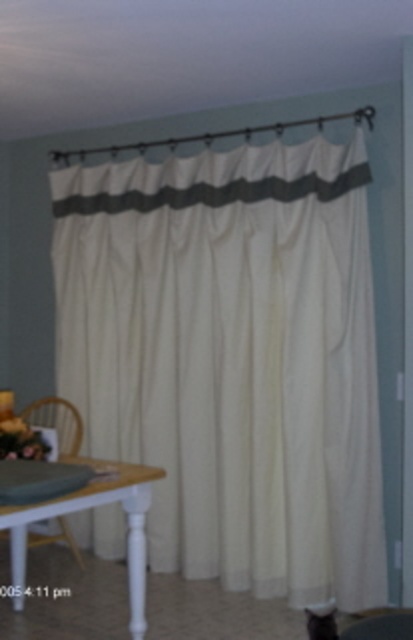
Locate an element on the screen. Image resolution: width=413 pixels, height=640 pixels. white glossy table at lower left is located at coordinates (90, 508).

The height and width of the screenshot is (640, 413). Describe the element at coordinates (90, 508) in the screenshot. I see `white glossy table at lower left` at that location.

Does point (130, 468) come in front of point (322, 630)?

No.

Identify the location of white glossy table at lower left. This screenshot has width=413, height=640. (90, 508).

Is white textured curtain at center to the right of white glossy table at lower left from the viewer's perspective?

Correct, you'll find white textured curtain at center to the right of white glossy table at lower left.

Between white textured curtain at center and white glossy table at lower left, which one has more height?

Standing taller between the two is white textured curtain at center.

In order to click on white textured curtain at center in this screenshot , I will do `click(232, 358)`.

In the scene shown: Can you confirm if white textured curtain at center is bigger than wooden armchair at lower left?

Indeed, white textured curtain at center has a larger size compared to wooden armchair at lower left.

Is white textured curtain at center positioned in front of wooden armchair at lower left?

Yes.

Does point (268, 280) come in front of point (12, 422)?

No, (268, 280) is further to viewer.

Where is `white textured curtain at center`? white textured curtain at center is located at coordinates (232, 358).